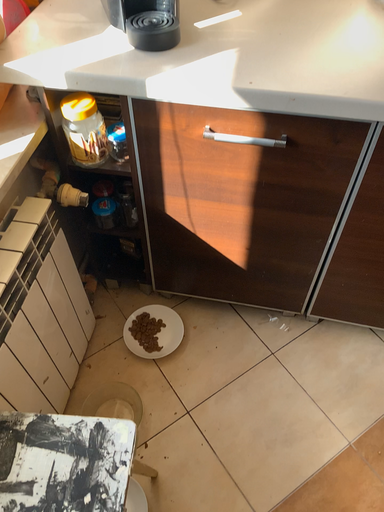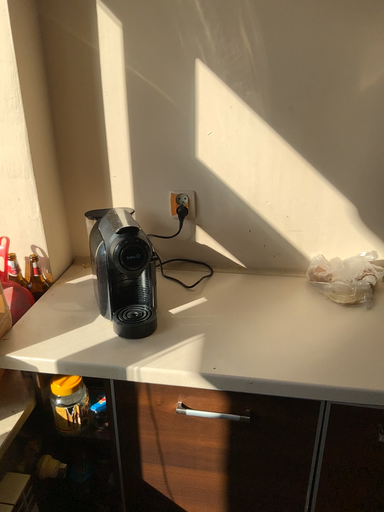
Question: How did the camera likely rotate when shooting the video?

Choices:
 (A) rotated downward
 (B) rotated upward

Answer: (B)